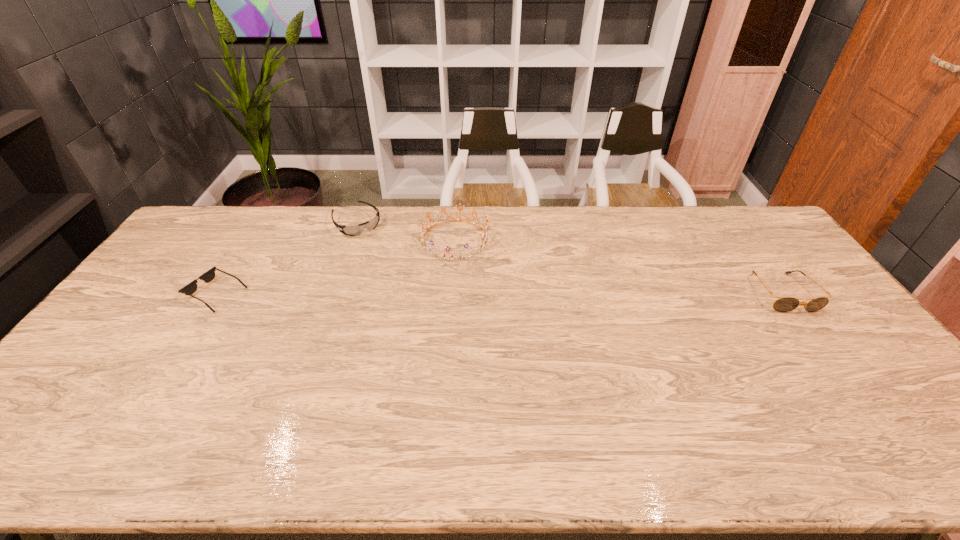
You are a GUI agent. You are given a task and a screenshot of the screen. Output one action in this format:
    pyautogui.click(x=<x>, y=<y>)
    Task: Click on the empty space between the leftmost object and the third shortest object
    The width and height of the screenshot is (960, 540).
    Given the screenshot: What is the action you would take?
    pyautogui.click(x=499, y=293)

Where is `free space between the second shortest sunglasses and the rightmost sunglasses`? The width and height of the screenshot is (960, 540). free space between the second shortest sunglasses and the rightmost sunglasses is located at coordinates (569, 258).

The width and height of the screenshot is (960, 540). What are the coordinates of `free point between the third object from left to right and the second shortest object` in the screenshot? It's located at (406, 231).

Image resolution: width=960 pixels, height=540 pixels. What are the coordinates of `vacant area between the tallest object and the shortest object` in the screenshot? It's located at (336, 267).

The image size is (960, 540). I want to click on free spot between the shortest sunglasses and the tallest object, so click(x=336, y=267).

Locate an element on the screen. object that is the third nearest to the rightmost sunglasses is located at coordinates (207, 277).

Locate an element on the screen. Image resolution: width=960 pixels, height=540 pixels. object identified as the closest to the farthest sunglasses is located at coordinates pyautogui.click(x=484, y=241).

I want to click on sunglasses that is the second nearest to the shortest object, so click(785, 304).

Point out which sunglasses is positioned as the second nearest to the leftmost object. Please provide its 2D coordinates. Your answer should be formatted as a tuple, i.e. [(x, y)], where the tuple contains the x and y coordinates of a point satisfying the conditions above.

[(785, 304)]

Identify the location of vacant space that satisfies the following two spatial constraints: 1. on the front side of the farthest sunglasses; 2. on the right side of the tiara. (x=351, y=239).